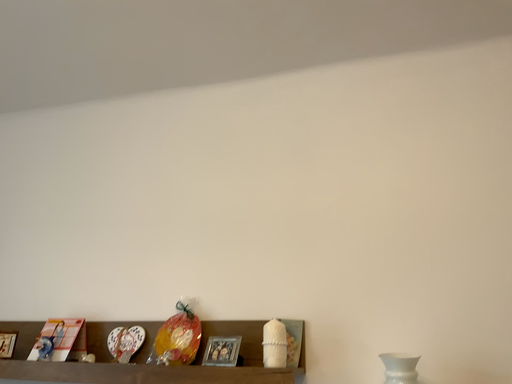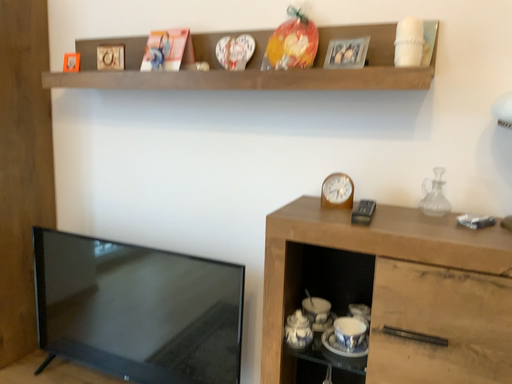
Question: Which way did the camera rotate in the video?

Choices:
 (A) rotated upward
 (B) rotated downward

Answer: (B)